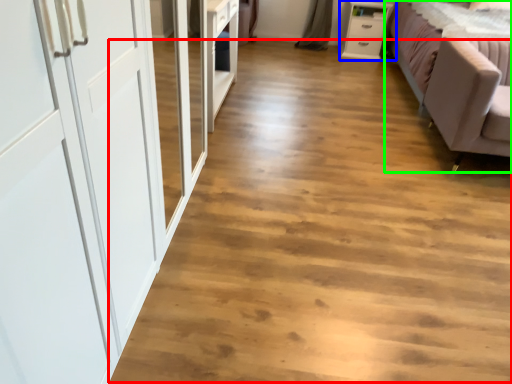
Question: Based on their relative distances, which object is nearer to plain (highlighted by a red box)? Choose from chest of drawers (highlighted by a blue box) and studio couch (highlighted by a green box).

Choices:
 (A) chest of drawers
 (B) studio couch

Answer: (B)